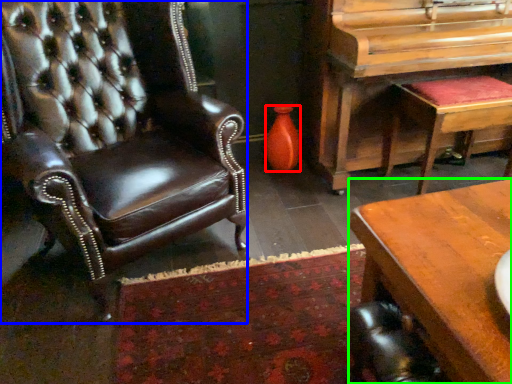
Question: Which object is the closest to the vase (highlighted by a red box)? Choose among these: chair (highlighted by a blue box) or desk (highlighted by a green box).

Choices:
 (A) chair
 (B) desk

Answer: (A)